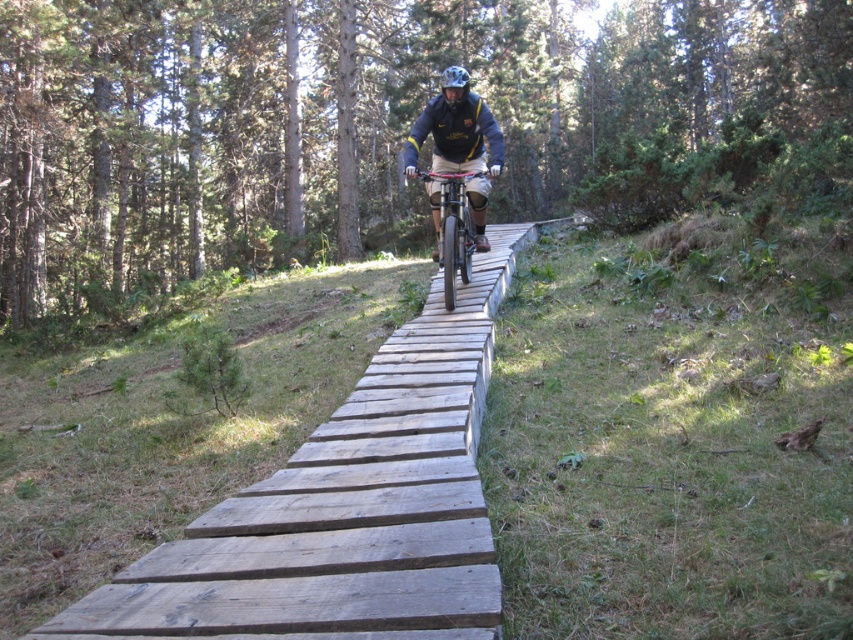
Question: Which object is positioned farthest from the matte black bicycle at center?

Choices:
 (A) matte white helmet at center
 (B) matte black helmet at center
 (C) weathered wood planks at center

Answer: (A)

Question: Does matte black bicycle at center have a greater width compared to matte white helmet at center?

Choices:
 (A) no
 (B) yes

Answer: (A)

Question: Is matte black helmet at center further to the viewer compared to matte black bicycle at center?

Choices:
 (A) no
 (B) yes

Answer: (A)

Question: Which point is closer to the camera?

Choices:
 (A) (463, 68)
 (B) (447, 138)
 (C) (456, 227)

Answer: (C)

Question: Which point appears farthest from the camera in this image?

Choices:
 (A) (444, 192)
 (B) (462, 68)
 (C) (390, 353)

Answer: (B)

Question: Is matte black bicycle at center further to camera compared to matte white helmet at center?

Choices:
 (A) no
 (B) yes

Answer: (A)